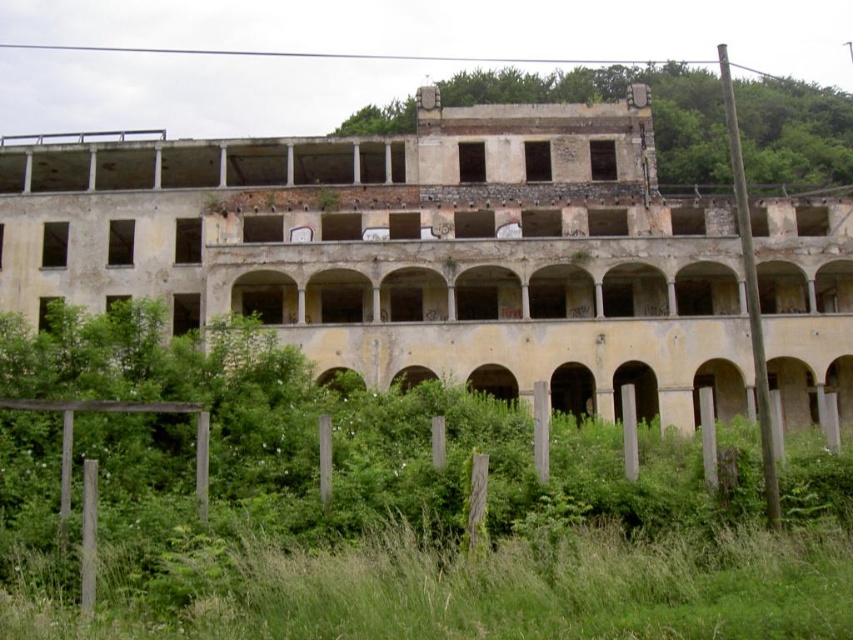
Which of these two, green grass at lower center or green grass at center, stands taller?

With more height is green grass at center.

Is green grass at lower center smaller than green grass at center?

Yes.

Between point (283, 502) and point (827, 96), which one is positioned in front?

Point (283, 502)

What are the coordinates of `green grass at lower center` in the screenshot? It's located at (387, 509).